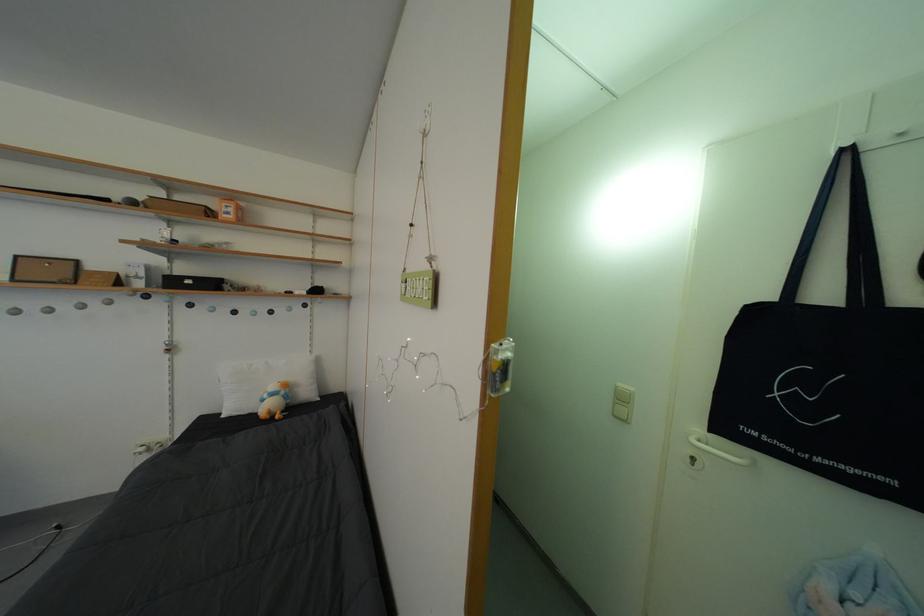
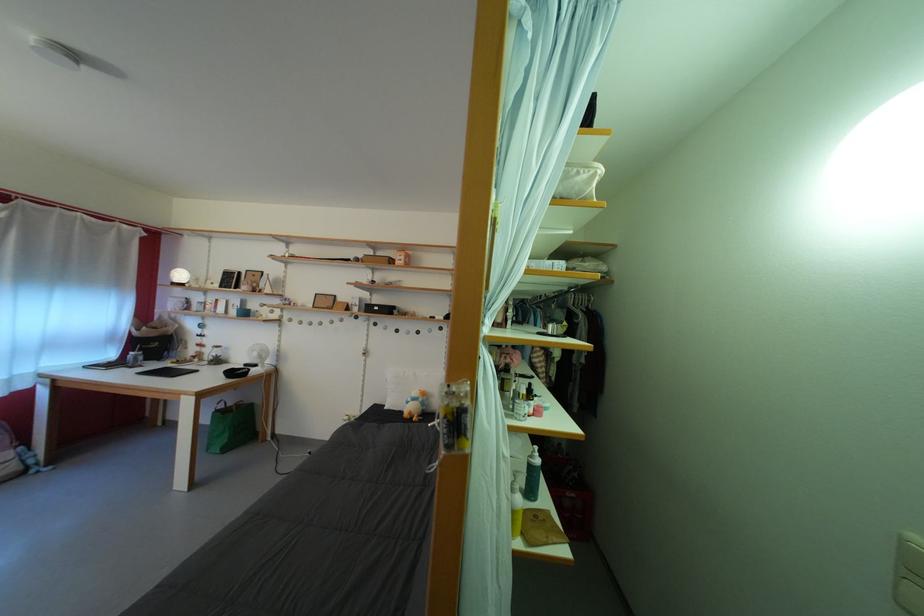
The point at (198, 288) is marked in the first image. Where is the corresponding point in the second image?

(384, 314)